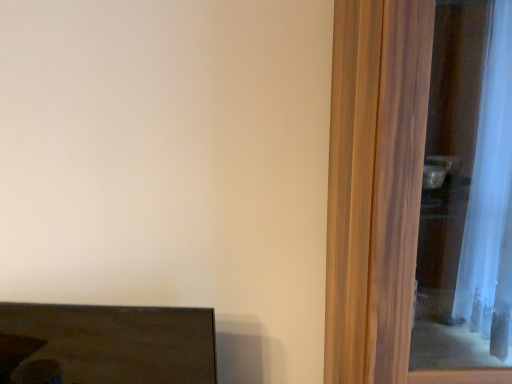
Question: From the image's perspective, is transparent glass screen door at right above or below matte dark brown coffee table at lower left?

Choices:
 (A) above
 (B) below

Answer: (A)

Question: In the image, is transparent glass screen door at right positioned in front of or behind matte dark brown coffee table at lower left?

Choices:
 (A) behind
 (B) front

Answer: (B)

Question: Choose the correct answer: Is transparent glass screen door at right inside matte dark brown coffee table at lower left or outside it?

Choices:
 (A) outside
 (B) inside

Answer: (A)

Question: Considering the positions of point (182, 377) and point (408, 1), is point (182, 377) closer or farther from the camera than point (408, 1)?

Choices:
 (A) closer
 (B) farther

Answer: (B)

Question: Is matte dark brown coffee table at lower left situated inside transparent glass screen door at right or outside?

Choices:
 (A) inside
 (B) outside

Answer: (B)

Question: From the image's perspective, is matte dark brown coffee table at lower left above or below transparent glass screen door at right?

Choices:
 (A) above
 (B) below

Answer: (B)

Question: From their relative heights in the image, would you say matte dark brown coffee table at lower left is taller or shorter than transparent glass screen door at right?

Choices:
 (A) tall
 (B) short

Answer: (B)